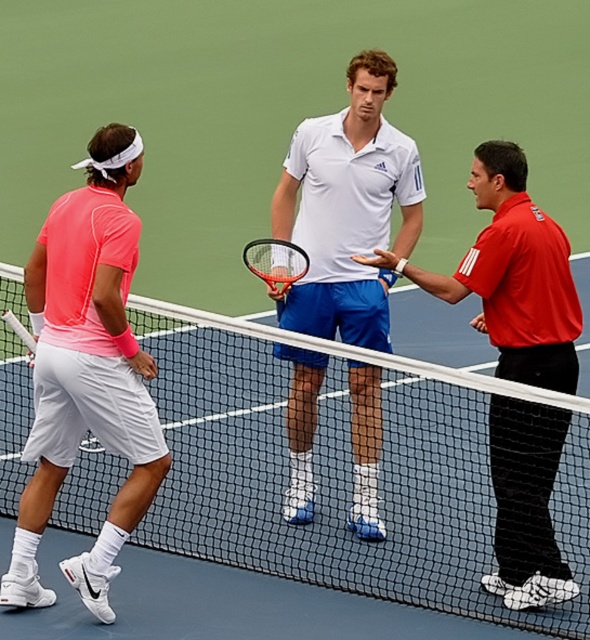
You are a tennis player standing at the baseline and want to pick up your racket. Which racket is closer to you, the white matte tennis racket at center or the matte black tennis racket at left?

The white matte tennis racket at center is closer to you because it is further to the viewer than the matte black tennis racket at left, meaning it is positioned nearer in the scene.